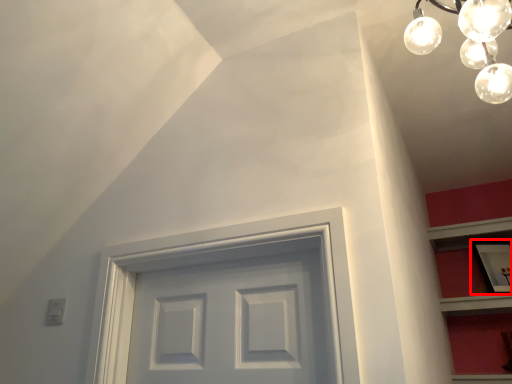
Question: From the image's perspective, where is picture frame (annotated by the red box) located relative to light fixture?

Choices:
 (A) below
 (B) above

Answer: (A)